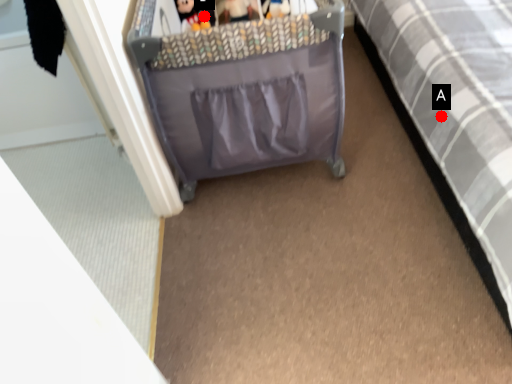
Question: Two points are circled on the image, labeled by A and B beside each circle. Which of the following is the closest to the observer?

Choices:
 (A) A is closer
 (B) B is closer

Answer: (B)